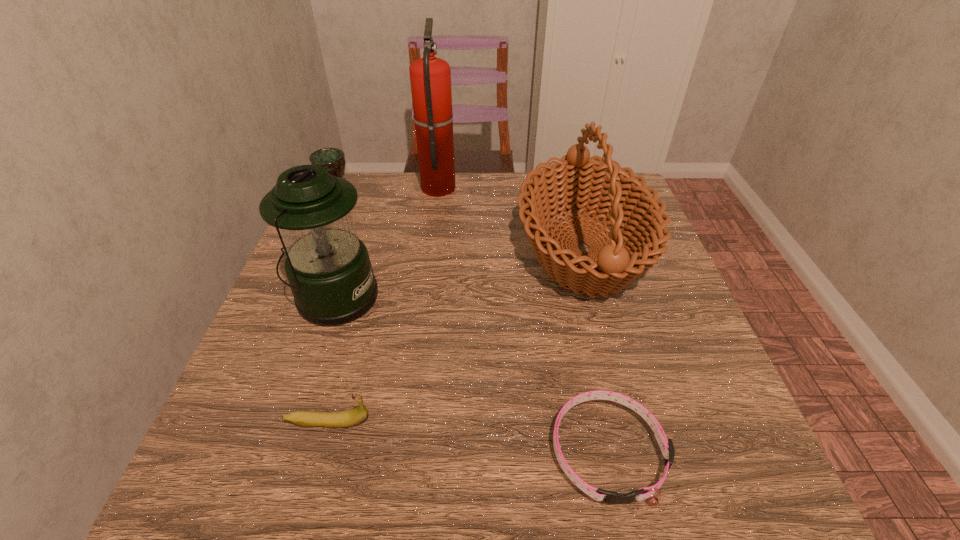
Locate an element on the screen. The height and width of the screenshot is (540, 960). dog collar that is at the right edge is located at coordinates (666, 445).

Identify the location of object situated at the far left corner. Image resolution: width=960 pixels, height=540 pixels. (328, 158).

The image size is (960, 540). In order to click on object that is positioned at the far right corner in this screenshot , I will do `click(574, 183)`.

Locate an element on the screen. This screenshot has height=540, width=960. object located at the near right corner is located at coordinates (666, 445).

In the image, there is a desktop. Where is `free space at the far edge`? The width and height of the screenshot is (960, 540). free space at the far edge is located at coordinates pos(402,215).

Locate an element on the screen. The image size is (960, 540). vacant space at the near edge of the desktop is located at coordinates (637, 488).

This screenshot has width=960, height=540. I want to click on free region at the left edge of the desktop, so click(x=243, y=391).

In the image, there is a desktop. At what (x,y) coordinates should I click in order to perform the action: click on blank space at the right edge. Please return your answer as a coordinate pair (x, y). The width and height of the screenshot is (960, 540). Looking at the image, I should click on (617, 325).

Where is `vacant region at the far left corner of the desktop`? This screenshot has height=540, width=960. vacant region at the far left corner of the desktop is located at coordinates (377, 181).

The height and width of the screenshot is (540, 960). I want to click on free space between the third shortest object and the basket, so click(461, 226).